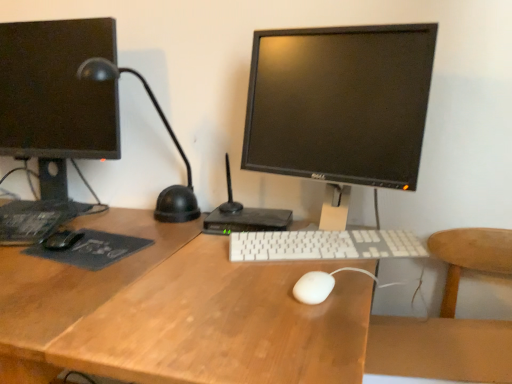
This screenshot has width=512, height=384. What do you see at coordinates (94, 250) in the screenshot? I see `dark gray matte mousepad at left` at bounding box center [94, 250].

Image resolution: width=512 pixels, height=384 pixels. What do you see at coordinates (451, 319) in the screenshot? I see `wooden at right` at bounding box center [451, 319].

Where is `black plastic router at center`? This screenshot has height=384, width=512. black plastic router at center is located at coordinates (244, 215).

Where is `matte black monitor at left, placed as the 1th computer monitor when sorted from left to right`? The height and width of the screenshot is (384, 512). matte black monitor at left, placed as the 1th computer monitor when sorted from left to right is located at coordinates (57, 96).

Where is `black matte desk lamp at left`? Image resolution: width=512 pixels, height=384 pixels. black matte desk lamp at left is located at coordinates click(170, 138).

What do you see at coordinates (170, 138) in the screenshot? I see `black matte desk lamp at left` at bounding box center [170, 138].

Find the location of a particular element. This screenshot has width=512, height=384. black matte mouse at left, which is the 1th mouse in left-to-right order is located at coordinates (62, 240).

Image resolution: width=512 pixels, height=384 pixels. I want to click on computer keyboard below the white matte mouse at center, arranged as the second mouse when viewed from the top (from a real-world perspective), so click(x=324, y=245).

In terms of width, does white plastic keyboard at center look wider or thinner when compared to white matte mouse at center, which ranks as the 1th mouse in bottom-to-top order?

Clearly, white plastic keyboard at center has more width compared to white matte mouse at center, which ranks as the 1th mouse in bottom-to-top order.

Is white plastic keyboard at center far away from white matte mouse at center, the second mouse viewed from the left?

No, there isn't a large distance between white plastic keyboard at center and white matte mouse at center, the second mouse viewed from the left.

Can you confirm if white plastic keyboard at center is shorter than white matte mouse at center, placed as the first mouse when sorted from right to left?

No.

Who is taller, white matte mouse at center, placed as the first mouse when sorted from right to left, or wooden at right?

wooden at right.

Based on the photo, is white matte mouse at center, placed as the first mouse when sorted from right to left, positioned before wooden at right?

No.

Find the location of a particular element. The height and width of the screenshot is (384, 512). computer chair on the right of white matte mouse at center, placed as the first mouse when sorted from right to left is located at coordinates (451, 319).

Is white matte mouse at center, placed as the first mouse when sorted from right to left, wider or thinner than wooden at right?

In the image, white matte mouse at center, placed as the first mouse when sorted from right to left, appears to be more narrow than wooden at right.

Locate an element on the screen. mouse that appears behind the white matte mouse at center, which appears as the first mouse when viewed from the front is located at coordinates (62, 240).

From the image's perspective, is white matte mouse at center, the second mouse viewed from the left, located above or below black matte mouse at left, the 2th mouse positioned from the right?

white matte mouse at center, the second mouse viewed from the left, is situated lower than black matte mouse at left, the 2th mouse positioned from the right, in the image.

Can you tell me how much white matte mouse at center, which appears as the first mouse when viewed from the front, and black matte mouse at left, the 2th mouse positioned from the right, differ in facing direction?

The angle between the facing direction of white matte mouse at center, which appears as the first mouse when viewed from the front, and the facing direction of black matte mouse at left, the 2th mouse positioned from the right, is 22.8 degrees.

Is white matte mouse at center, which appears as the first mouse when viewed from the front, next to black matte mouse at left, marked as the 1th mouse in a top-to-bottom arrangement?

No.

Considering the sizes of objects dark gray matte mousepad at left and black plastic router at center in the image provided, who is taller, dark gray matte mousepad at left or black plastic router at center?

black plastic router at center.

In the image, is dark gray matte mousepad at left on the left side or the right side of black plastic router at center?

From the image, it's evident that dark gray matte mousepad at left is to the left of black plastic router at center.

At what (x,y) coordinates should I click in order to perform the action: click on computer above the dark gray matte mousepad at left (from the image's perspective). Please return your answer as a coordinate pair (x, y). The width and height of the screenshot is (512, 384). Looking at the image, I should click on (244, 215).

Do you think dark gray matte mousepad at left is within black plastic router at center, or outside of it?

dark gray matte mousepad at left cannot be found inside black plastic router at center.

The image size is (512, 384). In order to click on mouse on the right of black plastic router at center in this screenshot , I will do `click(313, 287)`.

In the image, is white matte mouse at center, which appears as the first mouse when viewed from the front, positioned in front of or behind black plastic router at center?

white matte mouse at center, which appears as the first mouse when viewed from the front, is positioned closer to the viewer than black plastic router at center.

Is white matte mouse at center, placed as the first mouse when sorted from right to left, far from black plastic router at center?

white matte mouse at center, placed as the first mouse when sorted from right to left, is actually quite close to black plastic router at center.

Which object is positioned more to the left, white matte mouse at center, the second mouse from the back, or black plastic router at center?

black plastic router at center is more to the left.

Measure the distance between wooden desk at center and matte black monitor at left, placed as the 1th computer monitor when sorted from left to right.

wooden desk at center is 20.52 inches away from matte black monitor at left, placed as the 1th computer monitor when sorted from left to right.

Is wooden desk at center oriented away from matte black monitor at left, placed as the 1th computer monitor when sorted from left to right?

No, wooden desk at center is not facing the opposite direction of matte black monitor at left, placed as the 1th computer monitor when sorted from left to right.

Considering the sizes of objects wooden desk at center and matte black monitor at left, placed as the 1th computer monitor when sorted from left to right, in the image provided, who is thinner, wooden desk at center or matte black monitor at left, placed as the 1th computer monitor when sorted from left to right,?

matte black monitor at left, placed as the 1th computer monitor when sorted from left to right, is thinner.

From the image's perspective, who appears lower, wooden desk at center or matte black monitor at left, which is counted as the second computer monitor, starting from the right?

wooden desk at center is shown below in the image.

Considering the sizes of wooden desk at center and white matte mouse at center, which appears as the first mouse when viewed from the front, in the image, is wooden desk at center taller or shorter than white matte mouse at center, which appears as the first mouse when viewed from the front,?

wooden desk at center is taller than white matte mouse at center, which appears as the first mouse when viewed from the front.

Is wooden desk at center aimed at white matte mouse at center, the second mouse from the back?

No, wooden desk at center is not facing towards white matte mouse at center, the second mouse from the back.

Is wooden desk at center positioned far away from white matte mouse at center, the second mouse from the back?

No, wooden desk at center is not far from white matte mouse at center, the second mouse from the back.

Consider the image. Which object is further away from the camera taking this photo, wooden desk at center or white matte mouse at center, which ranks as the 1th mouse in bottom-to-top order?

white matte mouse at center, which ranks as the 1th mouse in bottom-to-top order, is further from the camera.

At what (x,y) coordinates should I click in order to perform the action: click on computer keyboard that is under the white matte mouse at center, the second mouse viewed from the left (from a real-world perspective). Please return your answer as a coordinate pair (x, y). The image size is (512, 384). Looking at the image, I should click on (324, 245).

Where is `mouse that is the 1st one when counting leftward from the wooden at right`? The width and height of the screenshot is (512, 384). mouse that is the 1st one when counting leftward from the wooden at right is located at coordinates (313, 287).

Looking at the image, which one is located closer to black matte mouse at left, marked as the 1th mouse in a top-to-bottom arrangement, wooden desk at center or black glossy monitor at center, which is counted as the first computer monitor, starting from the right?

wooden desk at center.

When comparing their distances from white plastic keyboard at center, does black plastic router at center or white matte mouse at center, placed as the first mouse when sorted from right to left, seem closer?

black plastic router at center is positioned closer to the anchor white plastic keyboard at center.

From the image, which object appears to be nearer to white matte mouse at center, arranged as the second mouse when viewed from the top, black plastic router at center or black matte desk lamp at left?

The object closer to white matte mouse at center, arranged as the second mouse when viewed from the top, is black plastic router at center.

From the image, which object appears to be nearer to black matte mouse at left, the 2th mouse positioned from the right, matte black monitor at left, which is counted as the second computer monitor, starting from the right, or black matte desk lamp at left?

Based on the image, black matte desk lamp at left appears to be nearer to black matte mouse at left, the 2th mouse positioned from the right.

Considering their positions, is black matte desk lamp at left positioned closer to black glossy monitor at center, which is counted as the first computer monitor, starting from the right, than dark gray matte mousepad at left?

black matte desk lamp at left is closer to black glossy monitor at center, which is counted as the first computer monitor, starting from the right.

Looking at the image, which one is located further to black matte mouse at left, marked as the 1th mouse in a top-to-bottom arrangement, wooden desk at center or matte black monitor at left, placed as the 1th computer monitor when sorted from left to right?

matte black monitor at left, placed as the 1th computer monitor when sorted from left to right, is further to black matte mouse at left, marked as the 1th mouse in a top-to-bottom arrangement.

Considering their positions, is black matte desk lamp at left positioned closer to wooden at right than dark gray matte mousepad at left?

Among the two, dark gray matte mousepad at left is located nearer to wooden at right.

Considering their positions, is white plastic keyboard at center positioned further to black matte desk lamp at left than matte black monitor at left, which is counted as the second computer monitor, starting from the right?

The object further to black matte desk lamp at left is white plastic keyboard at center.

Find the location of a particular element. Image resolution: width=512 pixels, height=384 pixels. mouse between matte black monitor at left, which is counted as the second computer monitor, starting from the right, and white matte mouse at center, which appears as the first mouse when viewed from the front, in the horizontal direction is located at coordinates (62, 240).

The width and height of the screenshot is (512, 384). Identify the location of desk located between black matte mouse at left, marked as the first mouse in a back-to-front arrangement, and wooden at right in the left-right direction. (177, 314).

Where is `computer keyboard between dark gray matte mousepad at left and black glossy monitor at center, which is counted as the first computer monitor, starting from the right, from left to right`? This screenshot has height=384, width=512. computer keyboard between dark gray matte mousepad at left and black glossy monitor at center, which is counted as the first computer monitor, starting from the right, from left to right is located at coordinates pyautogui.click(x=324, y=245).

What are the coordinates of `computer located between black matte mouse at left, which is the 1th mouse in left-to-right order, and white plastic keyboard at center in the left-right direction` in the screenshot? It's located at (244, 215).